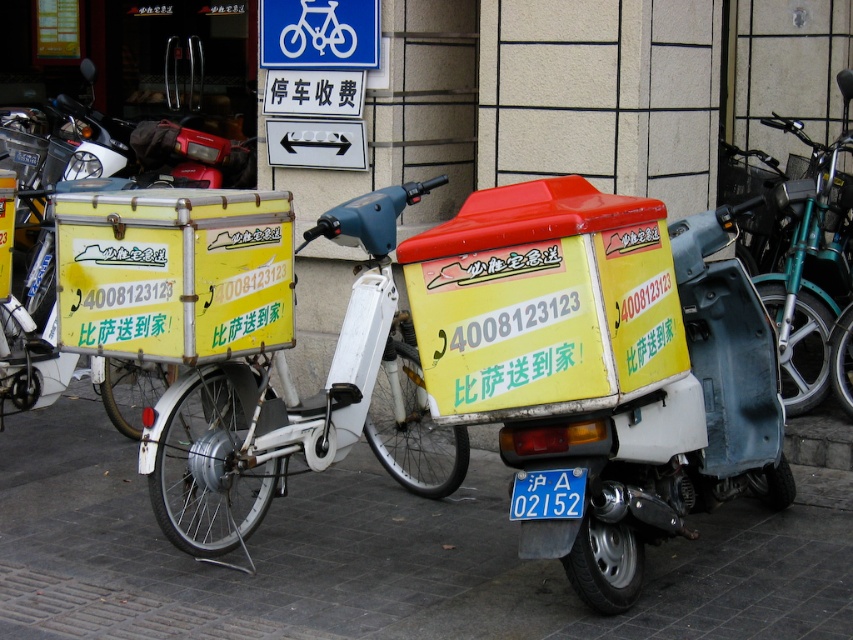
Which is above, yellow matte delivery bike at center or blue metallic license plate at center?

yellow matte delivery bike at center

Which of these two, yellow matte delivery bike at center or blue metallic license plate at center, stands taller?

Standing taller between the two is yellow matte delivery bike at center.

Between point (173, 420) and point (512, 483), which one is positioned in front?

Point (512, 483) is more forward.

You are a GUI agent. You are given a task and a screenshot of the screen. Output one action in this format:
    pyautogui.click(x=<x>, y=<y>)
    Task: Click on the yellow matte delivery bike at center
    This screenshot has width=853, height=640.
    Given the screenshot: What is the action you would take?
    pyautogui.click(x=276, y=401)

Between gray concrete pavement at lower center and yellow matte delivery bike at center, which one has more height?

yellow matte delivery bike at center

Between point (300, 605) and point (248, 493), which one is positioned behind?

The point (248, 493) is more distant.

Locate an element on the screen. gray concrete pavement at lower center is located at coordinates (380, 556).

The image size is (853, 640). I want to click on gray concrete pavement at lower center, so click(x=380, y=556).

Between gray concrete pavement at lower center and blue metallic license plate at center, which one is positioned higher?

blue metallic license plate at center is higher up.

Who is more forward, (x=306, y=474) or (x=544, y=518)?

Point (x=544, y=518) is in front.

Locate an element on the screen. Image resolution: width=853 pixels, height=640 pixels. gray concrete pavement at lower center is located at coordinates (380, 556).